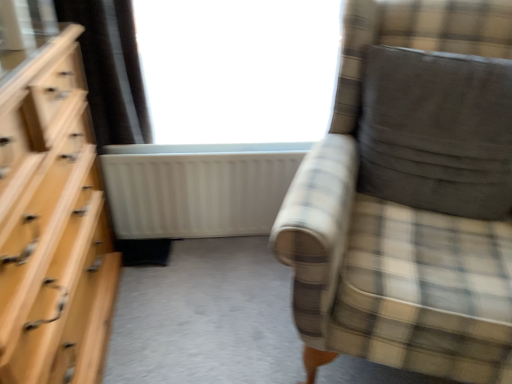
Question: In the image, is white matte radiator at center positioned in front of or behind plaid fabric chair at right?

Choices:
 (A) front
 (B) behind

Answer: (B)

Question: From their relative heights in the image, would you say white matte radiator at center is taller or shorter than plaid fabric chair at right?

Choices:
 (A) tall
 (B) short

Answer: (B)

Question: Which object is positioned farthest from the plaid fabric chair at right?

Choices:
 (A) white matte radiator at center
 (B) dark gray suede pillow at right
 (C) light wood dresser at left
 (D) transparent glass window at upper center

Answer: (C)

Question: Estimate the real-world distances between objects in this image. Which object is closer to the dark gray suede pillow at right?

Choices:
 (A) light wood dresser at left
 (B) transparent glass window at upper center
 (C) plaid fabric chair at right
 (D) white matte radiator at center

Answer: (C)